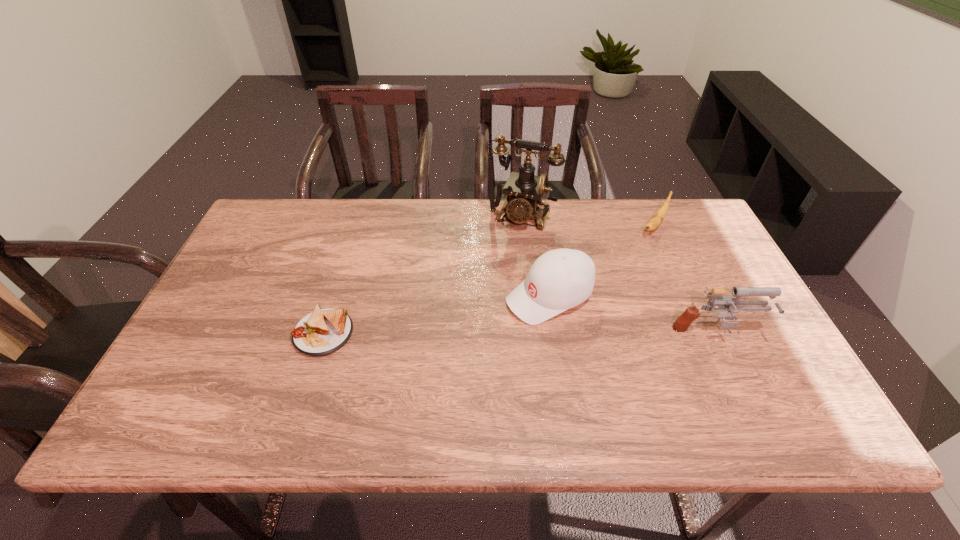
Find the location of a particular element. free space located on the rotary dial of the telephone is located at coordinates (498, 264).

Identify the location of vacant space located on the rotary dial of the telephone. This screenshot has height=540, width=960. (500, 259).

Identify the location of free region located 0.260m on the rotary dial of the telephone. (487, 291).

You are a GUI agent. You are given a task and a screenshot of the screen. Output one action in this format:
    pyautogui.click(x=<x>, y=<y>)
    Task: Click on the free space located on the peel of the banana from the top
    
    Given the screenshot: What is the action you would take?
    pyautogui.click(x=612, y=285)

The width and height of the screenshot is (960, 540). Identify the location of vacant space situated on the peel of the banana from the top. (638, 250).

Where is `vacant region located 0.360m on the peel of the banana from the top`? The width and height of the screenshot is (960, 540). vacant region located 0.360m on the peel of the banana from the top is located at coordinates (594, 307).

What are the coordinates of `telephone that is at the far edge` in the screenshot? It's located at (524, 190).

Where is `banana that is at the far edge`? banana that is at the far edge is located at coordinates (656, 220).

Image resolution: width=960 pixels, height=540 pixels. Identify the location of gun present at the right edge. (725, 303).

You are a GUI agent. You are given a task and a screenshot of the screen. Output one action in this format:
    pyautogui.click(x=<x>, y=<y>)
    Task: Click on the banana present at the right edge
    The width and height of the screenshot is (960, 540).
    Given the screenshot: What is the action you would take?
    pyautogui.click(x=656, y=220)